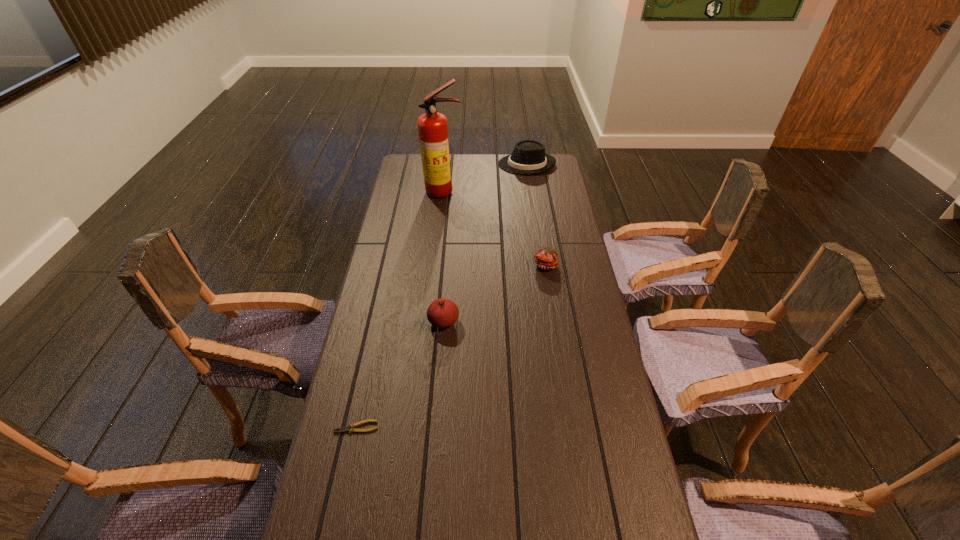
Locate an element on the screen. vacant space positioned on the front-facing side of the farthest object is located at coordinates (477, 164).

Locate an element on the screen. free space located 0.390m on the front-facing side of the farthest object is located at coordinates (418, 164).

Image resolution: width=960 pixels, height=540 pixels. In order to click on vacant space located on the front-facing side of the farthest object in this screenshot , I will do (x=471, y=164).

Identify the location of vacant space positioned 0.220m on the back of the second nearest object. Image resolution: width=960 pixels, height=540 pixels. (447, 265).

This screenshot has height=540, width=960. What are the coordinates of `vacant area situated on the front of the shorter tomato` in the screenshot? It's located at (555, 314).

You are a GUI agent. You are given a task and a screenshot of the screen. Output one action in this format:
    pyautogui.click(x=<x>, y=<y>)
    Task: Click on the free space located 0.240m on the back of the pliers
    This screenshot has height=540, width=960.
    Given the screenshot: What is the action you would take?
    pyautogui.click(x=373, y=348)

Where is `object that is at the far edge`? The height and width of the screenshot is (540, 960). object that is at the far edge is located at coordinates (528, 157).

This screenshot has width=960, height=540. What are the coordinates of `fire extinguisher that is positioned at the left edge` in the screenshot? It's located at (432, 126).

Identify the location of pliers that is positioned at the left edge. The height and width of the screenshot is (540, 960). (345, 428).

At what (x,y) coordinates should I click in order to perform the action: click on fedora present at the right edge. Please return your answer as a coordinate pair (x, y). The height and width of the screenshot is (540, 960). Looking at the image, I should click on (528, 157).